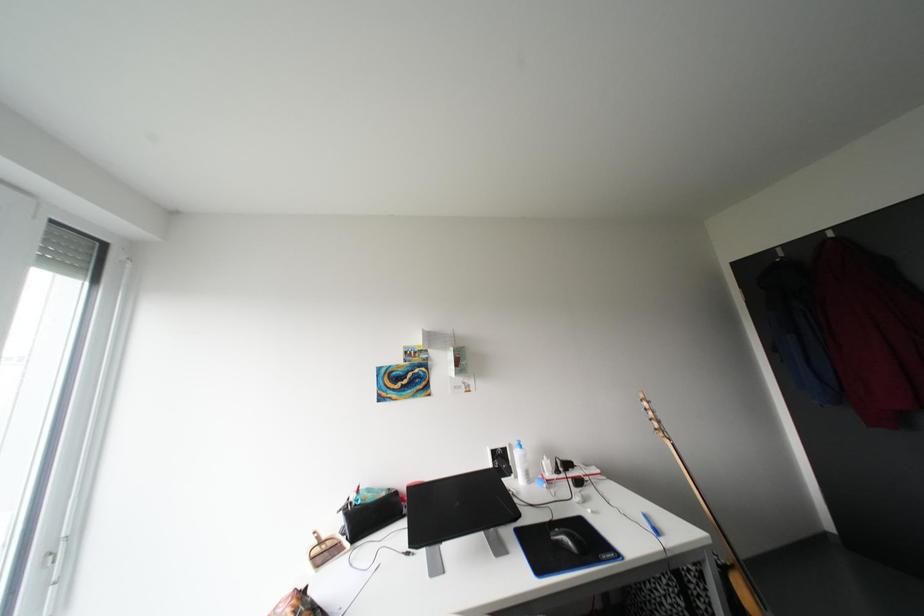
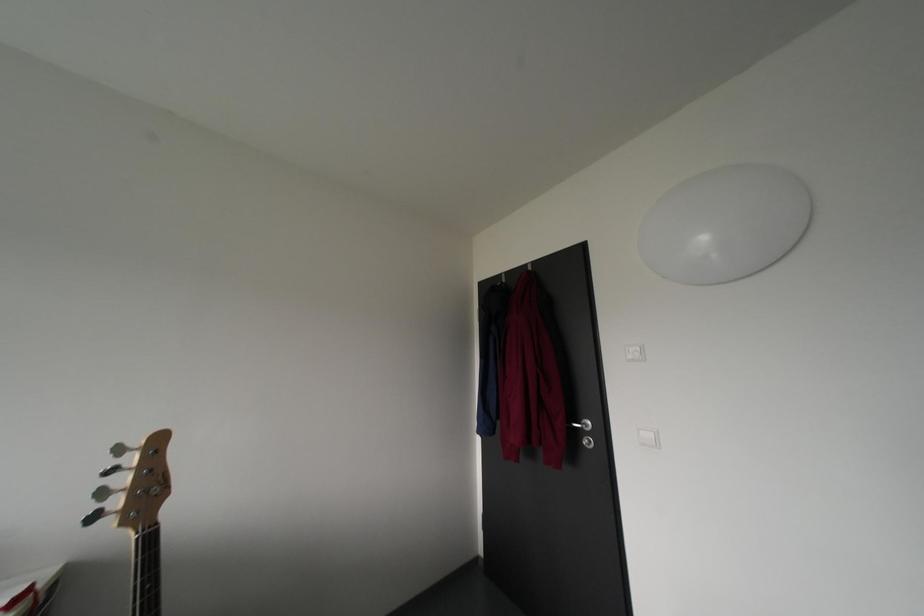
Question: What movement of the cameraman would produce the second image?

Choices:
 (A) Left
 (B) Right
 (C) Forward
 (D) Backward

Answer: (B)